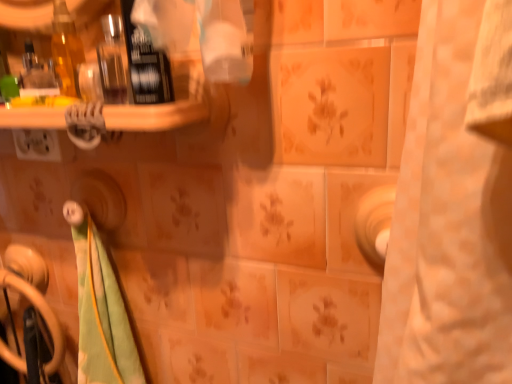
Describe the element at coordinates (155, 115) in the screenshot. I see `white plastic toothbrushes at upper left` at that location.

At what (x,y) coordinates should I click in order to perform the action: click on white plastic toothbrushes at upper left. Please return your answer as a coordinate pair (x, y). The image size is (512, 384). Looking at the image, I should click on (155, 115).

Consider the image. What is the approximate width of black plastic door handle at lower left?

The width of black plastic door handle at lower left is 4.02 inches.

The width and height of the screenshot is (512, 384). Describe the element at coordinates (40, 312) in the screenshot. I see `black plastic door handle at lower left` at that location.

Find the location of a particular element. black plastic door handle at lower left is located at coordinates (40, 312).

Measure the distance between black plastic door handle at lower left and camera.

black plastic door handle at lower left is 30.95 inches from camera.

In order to face black plastic door handle at lower left, should I rotate leftwards or rightwards?

To face it directly, rotate left by 27.239 degrees.

Where is `white plastic toothbrushes at upper left`? white plastic toothbrushes at upper left is located at coordinates (155, 115).

Considering the relative positions of black plastic door handle at lower left and white plastic toothbrushes at upper left in the image provided, is black plastic door handle at lower left to the left of white plastic toothbrushes at upper left from the viewer's perspective?

Indeed, black plastic door handle at lower left is positioned on the left side of white plastic toothbrushes at upper left.

Which is in front, black plastic door handle at lower left or white plastic toothbrushes at upper left?

Positioned in front is white plastic toothbrushes at upper left.

Does point (13, 280) lie in front of point (139, 105)?

No, (13, 280) is behind (139, 105).

From the image's perspective, is black plastic door handle at lower left below white plastic toothbrushes at upper left?

Yes, from the image's perspective, black plastic door handle at lower left is beneath white plastic toothbrushes at upper left.

From a real-world perspective, between black plastic door handle at lower left and white plastic toothbrushes at upper left, who is vertically lower?

black plastic door handle at lower left is physically lower.

Which of these two, black plastic door handle at lower left or white plastic toothbrushes at upper left, is wider?

white plastic toothbrushes at upper left.

Considering the relative sizes of black plastic door handle at lower left and white plastic toothbrushes at upper left in the image provided, is black plastic door handle at lower left shorter than white plastic toothbrushes at upper left?

No.

Looking at the image, does black plastic door handle at lower left seem bigger or smaller compared to white plastic toothbrushes at upper left?

Considering their sizes, black plastic door handle at lower left takes up more space than white plastic toothbrushes at upper left.

Do you think black plastic door handle at lower left is within white plastic toothbrushes at upper left, or outside of it?

black plastic door handle at lower left is not enclosed by white plastic toothbrushes at upper left.

Based on the photo, are black plastic door handle at lower left and white plastic toothbrushes at upper left beside each other?

No, black plastic door handle at lower left is not in contact with white plastic toothbrushes at upper left.

Is black plastic door handle at lower left aimed at white plastic toothbrushes at upper left?

No.

Can you tell me how much black plastic door handle at lower left and white plastic toothbrushes at upper left differ in facing direction?

black plastic door handle at lower left and white plastic toothbrushes at upper left are facing 2.08 degrees away from each other.

Image resolution: width=512 pixels, height=384 pixels. I want to click on door handle on the left of white plastic toothbrushes at upper left, so click(40, 312).

Which object is positioned more to the left, white plastic toothbrushes at upper left or black plastic door handle at lower left?

black plastic door handle at lower left is more to the left.

Is white plastic toothbrushes at upper left positioned behind black plastic door handle at lower left?

No, white plastic toothbrushes at upper left is in front of black plastic door handle at lower left.

Considering the points (108, 107) and (60, 338), which point is behind, point (108, 107) or point (60, 338)?

Positioned behind is point (60, 338).

From the image's perspective, which is above, white plastic toothbrushes at upper left or black plastic door handle at lower left?

white plastic toothbrushes at upper left is shown above in the image.

From a real-world perspective, between white plastic toothbrushes at upper left and black plastic door handle at lower left, who is vertically lower?

In real-world perspective, black plastic door handle at lower left is lower.

Can you confirm if white plastic toothbrushes at upper left is wider than black plastic door handle at lower left?

Correct, the width of white plastic toothbrushes at upper left exceeds that of black plastic door handle at lower left.

In terms of height, does white plastic toothbrushes at upper left look taller or shorter compared to black plastic door handle at lower left?

Considering their sizes, white plastic toothbrushes at upper left has less height than black plastic door handle at lower left.

Looking at the image, does white plastic toothbrushes at upper left seem bigger or smaller compared to black plastic door handle at lower left?

Clearly, white plastic toothbrushes at upper left is smaller in size than black plastic door handle at lower left.

Would you say black plastic door handle at lower left is part of white plastic toothbrushes at upper left's contents?

No, black plastic door handle at lower left is not surrounded by white plastic toothbrushes at upper left.

Is white plastic toothbrushes at upper left touching black plastic door handle at lower left?

No.

Is black plastic door handle at lower left at the back of white plastic toothbrushes at upper left?

white plastic toothbrushes at upper left does not have its back to black plastic door handle at lower left.

How far apart are white plastic toothbrushes at upper left and black plastic door handle at lower left?

They are 16.73 inches apart.

Find the location of a particular element. This screenshot has height=384, width=512. door handle below the white plastic toothbrushes at upper left (from a real-world perspective) is located at coordinates (40, 312).

You are a GUI agent. You are given a task and a screenshot of the screen. Output one action in this format:
    pyautogui.click(x=<x>, y=<y>)
    Task: Click on the ledge that is on the right side of black plastic door handle at lower left
    This screenshot has height=384, width=512.
    Given the screenshot: What is the action you would take?
    pyautogui.click(x=155, y=115)

Identify the location of ledge above the black plastic door handle at lower left (from the image's perspective). (155, 115).